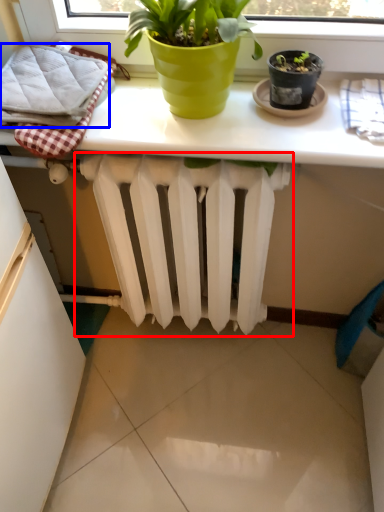
Question: Which point is closer to the camera, radiator (highlighted by a red box) or bath towel (highlighted by a blue box)?

Choices:
 (A) radiator
 (B) bath towel

Answer: (B)